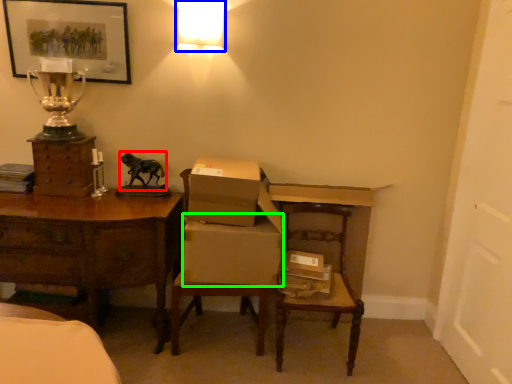
Question: Which object is the closest to the animal (highlighted by a red box)? Choose among these: lamp (highlighted by a blue box) or cardboard box (highlighted by a green box).

Choices:
 (A) lamp
 (B) cardboard box

Answer: (B)